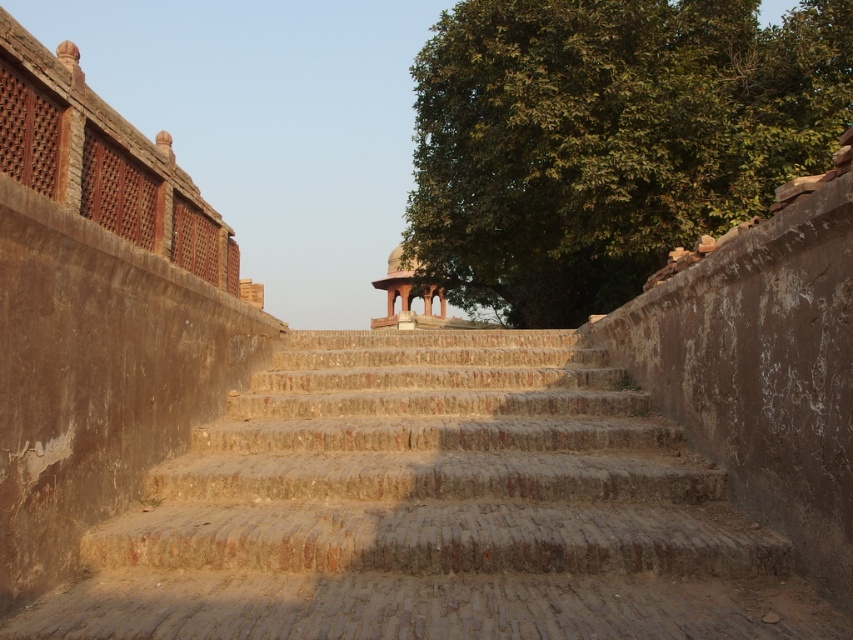
Consider the image. Which of these two, brown stone stairs at center or matte stone gazebo at center, stands taller?

Standing taller between the two is matte stone gazebo at center.

This screenshot has height=640, width=853. I want to click on brown stone stairs at center, so click(x=434, y=509).

Which is in front, point (74, 618) or point (398, 257)?

Positioned in front is point (74, 618).

Where is `brown stone stairs at center`? This screenshot has height=640, width=853. brown stone stairs at center is located at coordinates (434, 509).